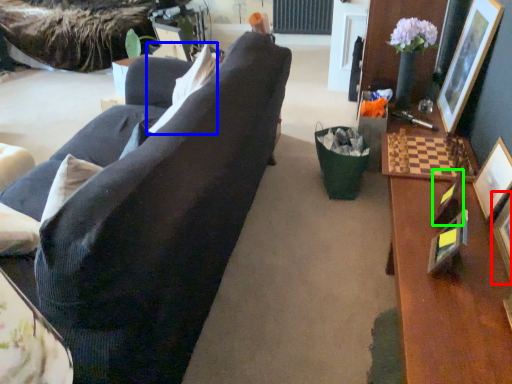
Question: Considering the real-world distances, which object is farthest from picture frame (highlighted by a red box)? pillow (highlighted by a blue box) or picture frame (highlighted by a green box)?

Choices:
 (A) pillow
 (B) picture frame

Answer: (A)